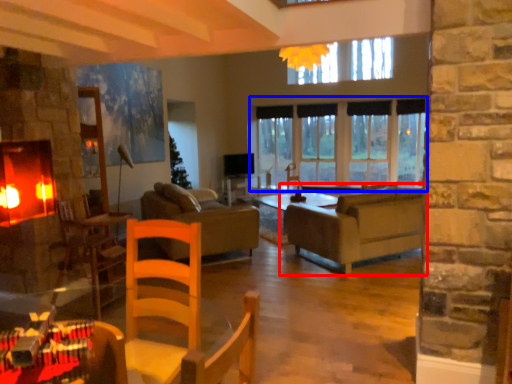
Question: Among these objects, which one is nearest to the camera, studio couch (highlighted by a red box) or window (highlighted by a blue box)?

Choices:
 (A) studio couch
 (B) window

Answer: (A)